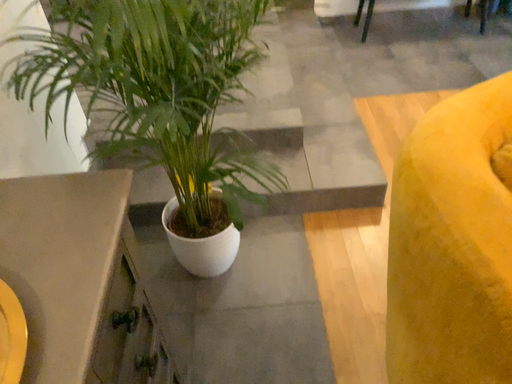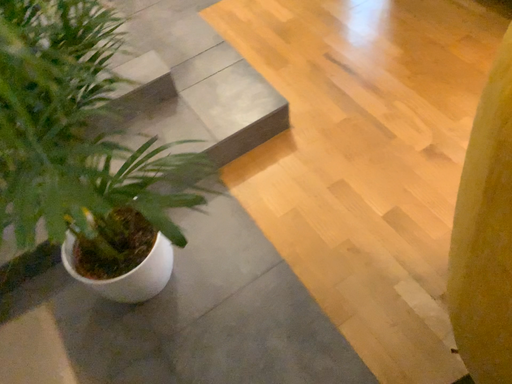
Question: How did the camera likely rotate when shooting the video?

Choices:
 (A) rotated upward
 (B) rotated downward

Answer: (B)